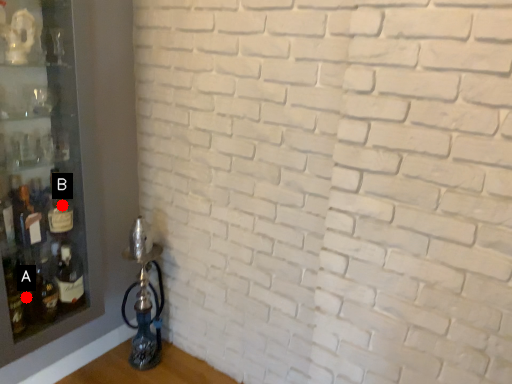
Question: Two points are circled on the image, labeled by A and B beside each circle. Which point is farther to the camera?

Choices:
 (A) A is further
 (B) B is further

Answer: (B)